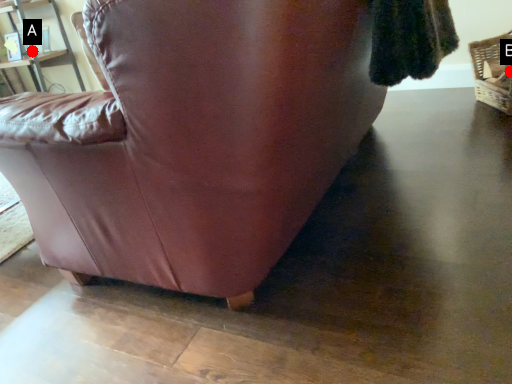
Question: Two points are circled on the image, labeled by A and B beside each circle. Which point appears farthest from the camera in this image?

Choices:
 (A) A is further
 (B) B is further

Answer: (A)